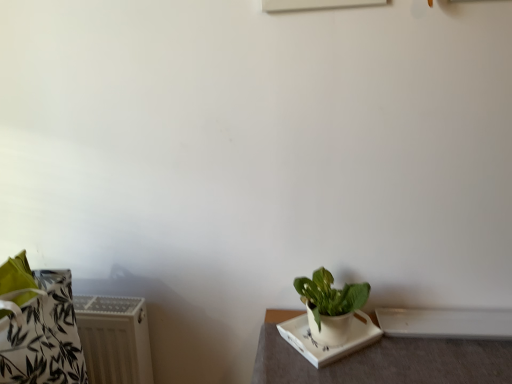
The image size is (512, 384). In order to click on free space in front of white ceramic plate at lower right in this screenshot , I will do `click(345, 371)`.